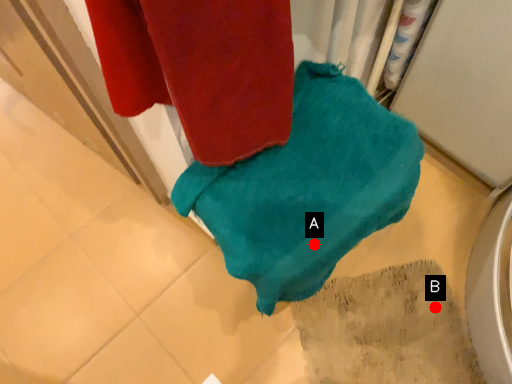
Question: Two points are circled on the image, labeled by A and B beside each circle. Which of the following is the closest to the observer?

Choices:
 (A) A is closer
 (B) B is closer

Answer: (A)